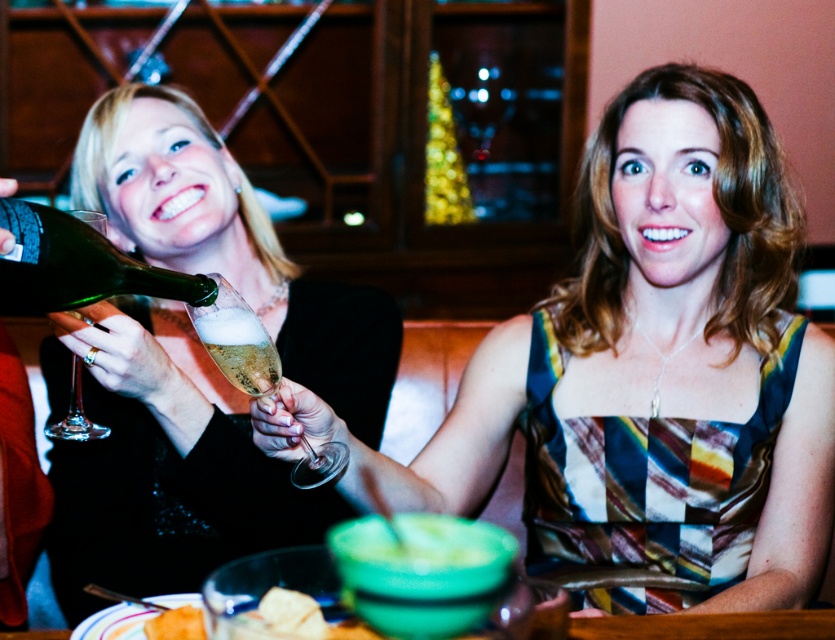
Which is in front, point (243, 230) or point (74, 381)?

Positioned in front is point (74, 381).

Find the location of a particular element. The image size is (835, 640). shiny black dress at left is located at coordinates (162, 465).

Does multicolored fabric dress at center come in front of crunchy tortilla chip at lower center?

No, it is behind crunchy tortilla chip at lower center.

Can you confirm if multicolored fabric dress at center is shorter than crunchy tortilla chip at lower center?

Incorrect, multicolored fabric dress at center's height does not fall short of crunchy tortilla chip at lower center's.

Is point (727, 580) positioned behind point (292, 604)?

Yes.

Where is `multicolored fabric dress at center`? Image resolution: width=835 pixels, height=640 pixels. multicolored fabric dress at center is located at coordinates (645, 372).

Is multicolored fabric dress at center smaller than green glass at left?

No, multicolored fabric dress at center is not smaller than green glass at left.

Is point (742, 99) less distant than point (82, 413)?

No, it is behind (82, 413).

Is point (721, 609) closer to camera compared to point (73, 401)?

No.

You are a GUI agent. You are given a task and a screenshot of the screen. Output one action in this format:
    pyautogui.click(x=<x>, y=<y>)
    Task: Click on the multicolored fabric dress at center
    The width and height of the screenshot is (835, 640).
    Given the screenshot: What is the action you would take?
    pyautogui.click(x=645, y=372)